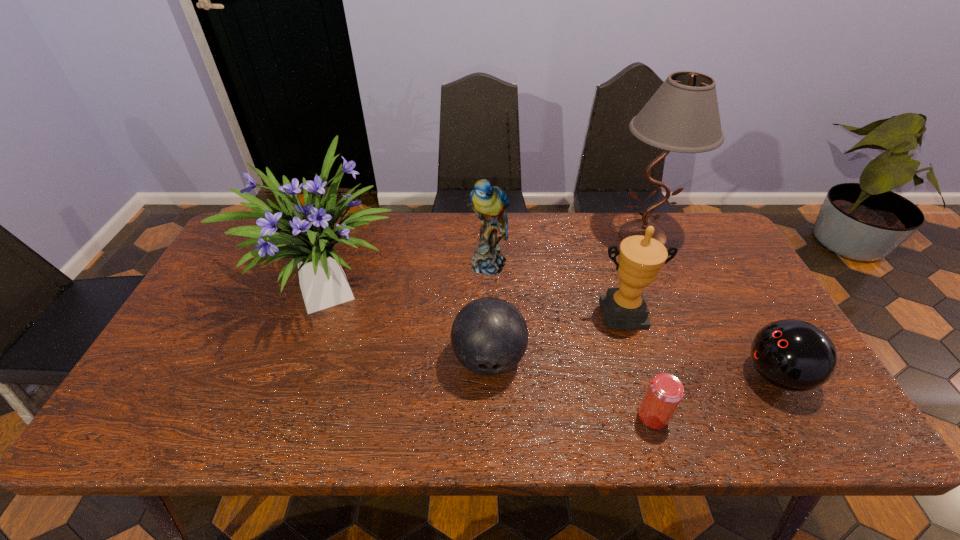
Where is `vacant space at the near right corner`? This screenshot has width=960, height=540. vacant space at the near right corner is located at coordinates (773, 410).

Where is `vacant area between the shortest object and the award`? The height and width of the screenshot is (540, 960). vacant area between the shortest object and the award is located at coordinates (637, 364).

Find the location of a particular element. unoccupied position between the leftmost object and the right bowling ball is located at coordinates (555, 330).

Identify the location of vacant point located between the shortest object and the right bowling ball. This screenshot has height=540, width=960. (714, 396).

Where is `vacant space that's between the left bowling ball and the award`? This screenshot has height=540, width=960. vacant space that's between the left bowling ball and the award is located at coordinates (556, 336).

Locate an element on the screen. The width and height of the screenshot is (960, 540). unoccupied area between the left bowling ball and the flower arrangement is located at coordinates (412, 322).

Find the location of `free spot between the left bowling ball and the flower arrangement`. free spot between the left bowling ball and the flower arrangement is located at coordinates (412, 322).

This screenshot has height=540, width=960. I want to click on vacant area that lies between the right bowling ball and the award, so click(699, 345).

Find the location of a particular element. free spot between the right bowling ball and the left bowling ball is located at coordinates (633, 367).

Locate an element on the screen. Image resolution: width=960 pixels, height=540 pixels. vacant region between the right bowling ball and the left bowling ball is located at coordinates (633, 367).